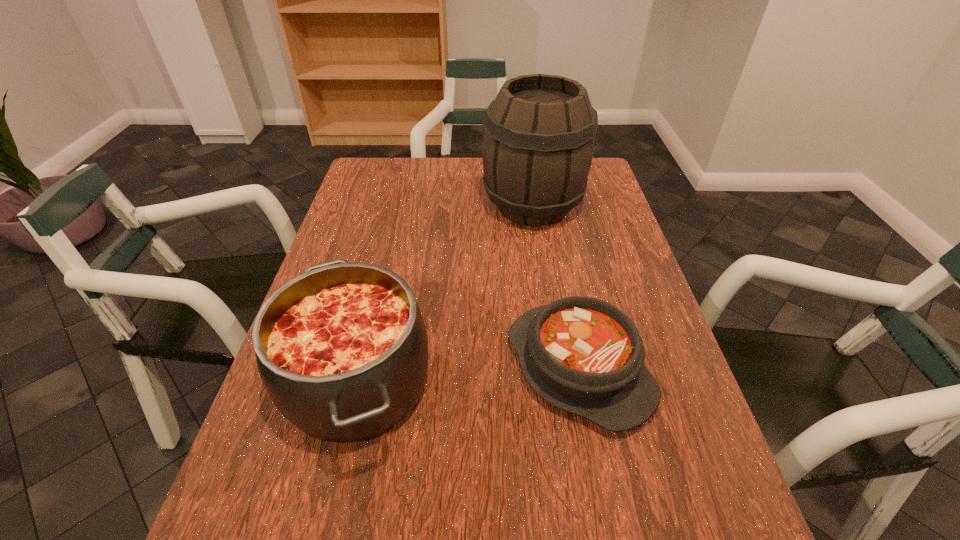
At what (x,y) coordinates should I click in order to perform the action: click on wine bucket. Please return your answer as a coordinate pair (x, y). This screenshot has height=540, width=960. Looking at the image, I should click on (538, 143).

The width and height of the screenshot is (960, 540). In order to click on the tallest object in this screenshot , I will do `click(538, 143)`.

Where is `the left casserole`? Image resolution: width=960 pixels, height=540 pixels. the left casserole is located at coordinates (342, 350).

The image size is (960, 540). What are the coordinates of `the taller casserole` in the screenshot? It's located at (342, 350).

Identify the location of the shortest object. The image size is (960, 540). (583, 355).

At what (x,y) coordinates should I click in order to perform the action: click on the right casserole. Please return your answer as a coordinate pair (x, y). Looking at the image, I should click on (583, 355).

The width and height of the screenshot is (960, 540). I want to click on vacant point located on the back of the wine bucket, so click(x=527, y=167).

Where is `vacant space located 0.200m on the back of the second tallest object`? This screenshot has height=540, width=960. vacant space located 0.200m on the back of the second tallest object is located at coordinates (388, 258).

The height and width of the screenshot is (540, 960). I want to click on free space located on the back of the shorter casserole, so click(x=564, y=297).

You are a GUI agent. You are given a task and a screenshot of the screen. Output one action in this format:
    pyautogui.click(x=<x>, y=<y>)
    Task: Click on the object located at the far edge
    
    Given the screenshot: What is the action you would take?
    pyautogui.click(x=538, y=143)